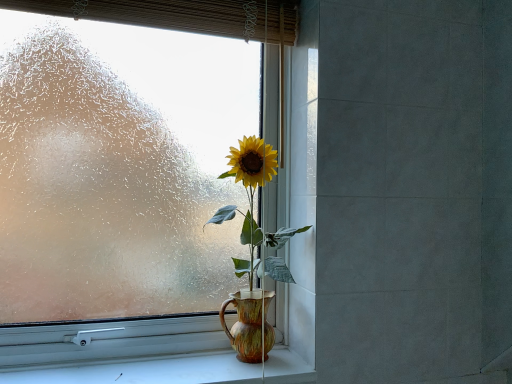
What do you see at coordinates (118, 186) in the screenshot? I see `frosted glass window at center` at bounding box center [118, 186].

Measure the distance between point (510, 143) and camera.

They are 1.24 meters apart.

Where is `frosted glass window at center`? The height and width of the screenshot is (384, 512). frosted glass window at center is located at coordinates (118, 186).

In the scene shown: Can you confirm if bamboo curtain at upper center is thinner than white smooth window sill at lower center?

Yes.

Find the location of a particular element. The width and height of the screenshot is (512, 384). curtain on the left of white smooth window sill at lower center is located at coordinates (182, 15).

Considering the sizes of objects bamboo curtain at upper center and white smooth window sill at lower center in the image provided, who is taller, bamboo curtain at upper center or white smooth window sill at lower center?

bamboo curtain at upper center is taller.

From the image's perspective, who appears lower, bamboo curtain at upper center or white smooth window sill at lower center?

From the image's view, white smooth window sill at lower center is below.

Does matte ceramic vase at center turn towards white smooth window sill at lower center?

No, matte ceramic vase at center is not turned towards white smooth window sill at lower center.

Looking at this image, is matte ceramic vase at center taller than white smooth window sill at lower center?

Yes, matte ceramic vase at center is taller than white smooth window sill at lower center.

Where is `houseplant behind the white smooth window sill at lower center`? This screenshot has width=512, height=384. houseplant behind the white smooth window sill at lower center is located at coordinates (253, 252).

Would you consider frosted glass window at center to be distant from gray tile at right?

No, there isn't a large distance between frosted glass window at center and gray tile at right.

Could you tell me if frosted glass window at center is facing gray tile at right?

No.

Consider the image. From the image's perspective, is frosted glass window at center on top of gray tile at right?

Correct, frosted glass window at center appears higher than gray tile at right in the image.

Between frosted glass window at center and gray tile at right, which one is positioned in front?

Positioned in front is gray tile at right.

Is matte ceramic vase at center thinner than gray tile at right?

Yes.

Would you say matte ceramic vase at center is a long distance from gray tile at right?

No, matte ceramic vase at center is not far away from gray tile at right.

From the image's perspective, is matte ceramic vase at center located above gray tile at right?

No, from the image's perspective, matte ceramic vase at center is not on top of gray tile at right.

What are the coordinates of `window sill on the right of frosted glass window at center` in the screenshot? It's located at click(146, 371).

Is white smooth window sill at lower center facing away from frosted glass window at center?

Yes, white smooth window sill at lower center's orientation is away from frosted glass window at center.

From a real-world perspective, between white smooth window sill at lower center and frosted glass window at center, who is vertically higher?

From a 3D spatial view, frosted glass window at center is above.

Between white smooth window sill at lower center and frosted glass window at center, which one appears on the left side from the viewer's perspective?

frosted glass window at center.

Locate an element on the screen. window sill that is below the frosted glass window at center (from the image's perspective) is located at coordinates [146, 371].

Which is behind, point (189, 172) or point (300, 362)?

Positioned behind is point (189, 172).

From the image's perspective, is frosted glass window at center on white smooth window sill at lower center?

Yes, from the image's perspective, frosted glass window at center is over white smooth window sill at lower center.

From a real-world perspective, is frosted glass window at center physically below white smooth window sill at lower center?

Incorrect, from a real-world perspective, frosted glass window at center is higher than white smooth window sill at lower center.

Consider the image. Considering the sizes of objects bamboo curtain at upper center and matte ceramic vase at center in the image provided, who is smaller, bamboo curtain at upper center or matte ceramic vase at center?

Smaller between the two is bamboo curtain at upper center.

Relative to matte ceramic vase at center, is bamboo curtain at upper center in front or behind?

In the image, bamboo curtain at upper center appears in front of matte ceramic vase at center.

Is there a large distance between bamboo curtain at upper center and matte ceramic vase at center?

bamboo curtain at upper center is near matte ceramic vase at center, not far away.

What's the angular difference between bamboo curtain at upper center and matte ceramic vase at center's facing directions?

0.0602 degrees separate the facing orientations of bamboo curtain at upper center and matte ceramic vase at center.

Where is `curtain located above the white smooth window sill at lower center (from the image's perspective)`? The image size is (512, 384). curtain located above the white smooth window sill at lower center (from the image's perspective) is located at coordinates (182, 15).

Find the location of a particular element. This screenshot has height=384, width=512. window sill below the matte ceramic vase at center (from the image's perspective) is located at coordinates (146, 371).

From the picture: When comparing their distances from white smooth window sill at lower center, does frosted glass window at center or gray tile at right seem closer?

The object closer to white smooth window sill at lower center is frosted glass window at center.

Which object lies further to the anchor point matte ceramic vase at center, white smooth window sill at lower center or bamboo curtain at upper center?

bamboo curtain at upper center is positioned further to the anchor matte ceramic vase at center.

When comparing their distances from gray tile at right, does matte ceramic vase at center or white smooth window sill at lower center seem closer?

The object closer to gray tile at right is matte ceramic vase at center.

When comparing their distances from white smooth window sill at lower center, does frosted glass window at center or matte ceramic vase at center seem closer?

Among the two, matte ceramic vase at center is located nearer to white smooth window sill at lower center.

Which object lies further to the anchor point bamboo curtain at upper center, gray tile at right or matte ceramic vase at center?

Among the two, gray tile at right is located further to bamboo curtain at upper center.

Looking at this image, when comparing their distances from bamboo curtain at upper center, does matte ceramic vase at center or white smooth window sill at lower center seem closer?

Based on the image, matte ceramic vase at center appears to be nearer to bamboo curtain at upper center.

Which object lies nearer to the anchor point gray tile at right, frosted glass window at center or white smooth window sill at lower center?

frosted glass window at center is positioned closer to the anchor gray tile at right.

Estimate the real-world distances between objects in this image. Which object is closer to white smooth window sill at lower center, gray tile at right or bamboo curtain at upper center?

Among the two, gray tile at right is located nearer to white smooth window sill at lower center.

At what (x,y) coordinates should I click in order to perform the action: click on houseplant situated between white smooth window sill at lower center and gray tile at right from left to right. Please return your answer as a coordinate pair (x, y). Image resolution: width=512 pixels, height=384 pixels. Looking at the image, I should click on (253, 252).

Where is `backdrop that lies between bamboo curtain at upper center and white smooth window sill at lower center from top to bottom`? The height and width of the screenshot is (384, 512). backdrop that lies between bamboo curtain at upper center and white smooth window sill at lower center from top to bottom is located at coordinates (413, 189).

Find the location of a particular element. Image resolution: width=512 pixels, height=384 pixels. houseplant between bamboo curtain at upper center and gray tile at right is located at coordinates (253, 252).

You are a GUI agent. You are given a task and a screenshot of the screen. Output one action in this format:
    pyautogui.click(x=<x>, y=<y>)
    Task: Click on the window sill between frosted glass window at center and gray tile at right in the horizontal direction
    The width and height of the screenshot is (512, 384).
    Given the screenshot: What is the action you would take?
    pyautogui.click(x=146, y=371)